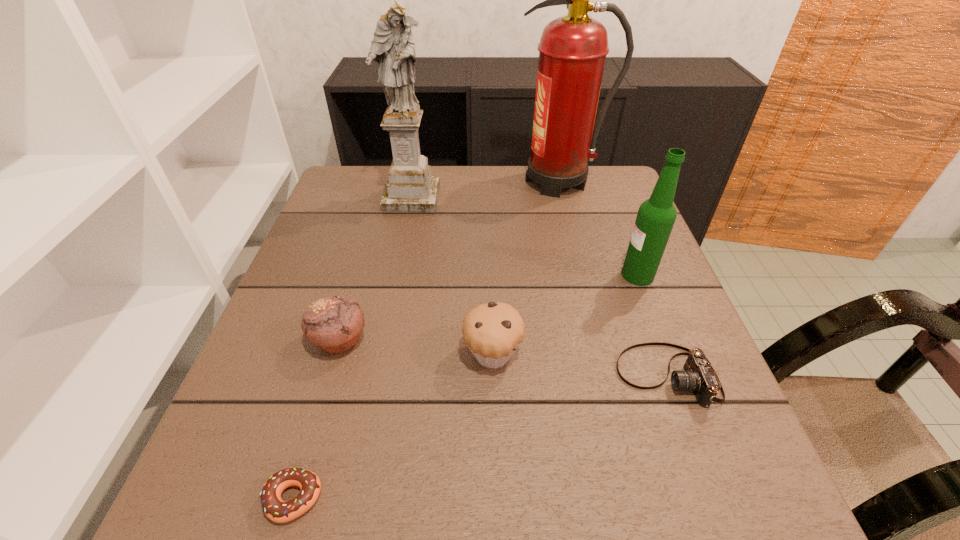
Identify the location of fire extinguisher. (572, 51).

The image size is (960, 540). What are the coordinates of `sculpture` in the screenshot? It's located at (410, 187).

This screenshot has width=960, height=540. Find the location of `the third farthest object`. the third farthest object is located at coordinates (656, 216).

Locate an element on the screen. The image size is (960, 540). beer bottle is located at coordinates (656, 216).

Locate an element on the screen. Image resolution: width=960 pixels, height=540 pixels. the right muffin is located at coordinates (492, 331).

The image size is (960, 540). What are the coordinates of `the left muffin` in the screenshot? It's located at (334, 324).

Find the location of `the sixth tallest object`. the sixth tallest object is located at coordinates (699, 376).

You are a GUI agent. You are given a task and a screenshot of the screen. Output one action in this format:
    pyautogui.click(x=<x>, y=<y>)
    Task: Click on the doughnut
    The width and height of the screenshot is (960, 540).
    Given the screenshot: What is the action you would take?
    pyautogui.click(x=277, y=510)

Find the location of a particular element. the shortest object is located at coordinates (277, 510).

What are the coordinates of `vacant space positioned 0.190m on the front-facing side of the fire extinguisher` in the screenshot? It's located at (444, 181).